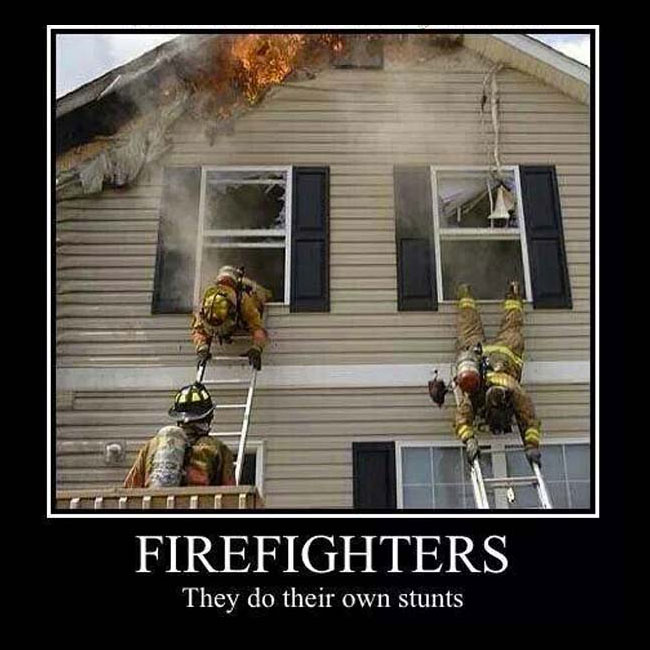
Identify the location of windows. The image size is (650, 650). (255, 221), (485, 255), (437, 478).